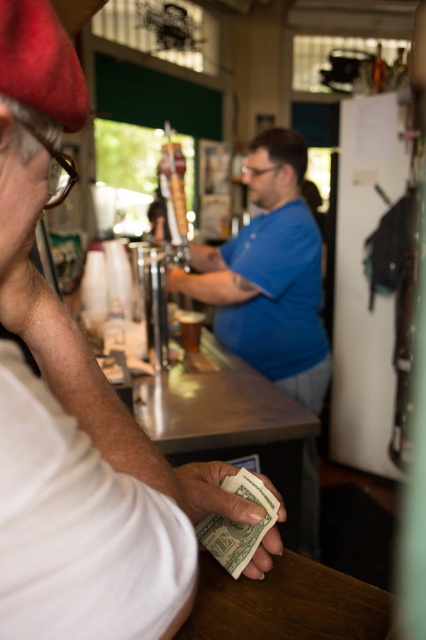
Does blue cotton shirt at center have a lesser width compared to white paper money at lower center?

No.

Between point (230, 307) and point (206, 467), which one is positioned in front?

Point (206, 467) is in front.

Locate an element on the screen. This screenshot has height=640, width=426. blue cotton shirt at center is located at coordinates (268, 275).